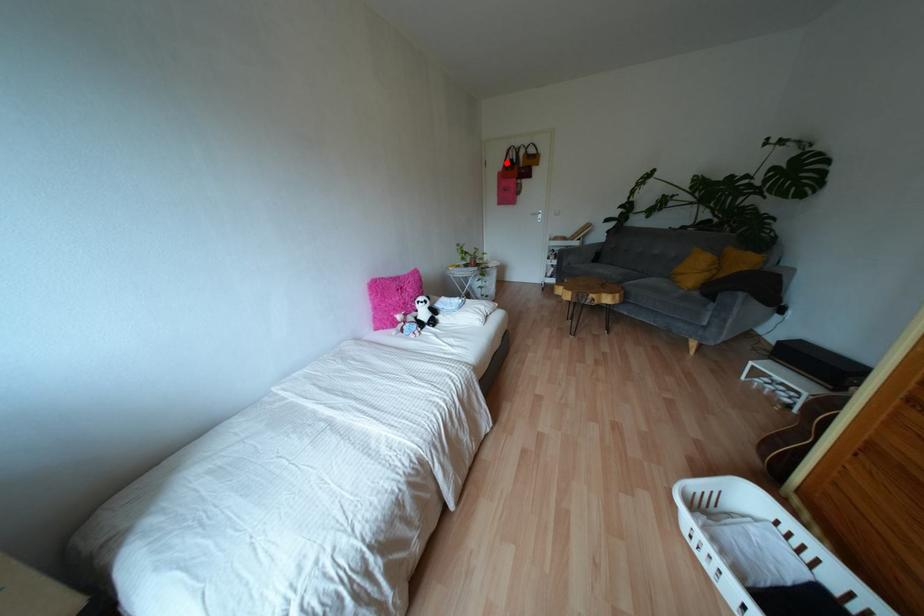
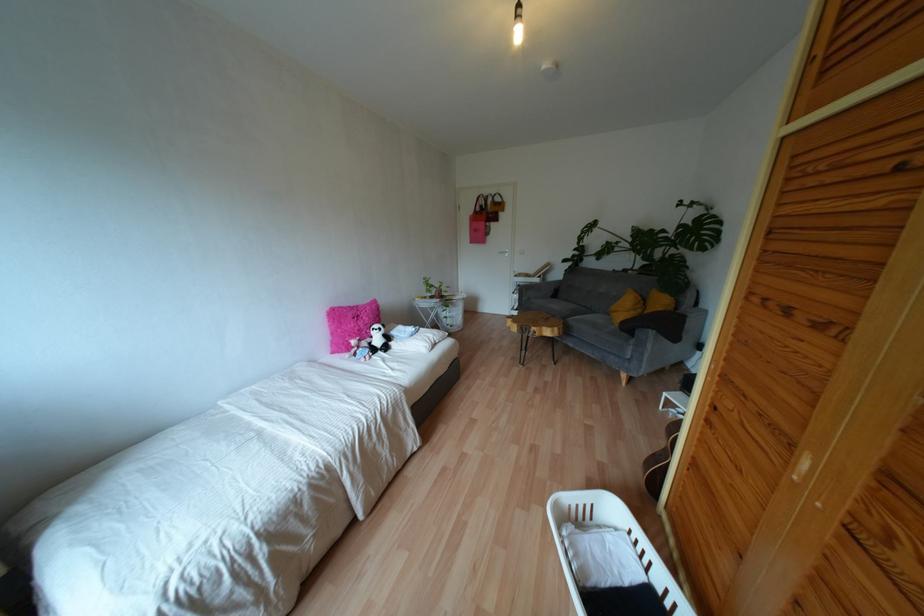
Where in the second image is the point corresponding to the highlighted location from the first image?

(477, 208)